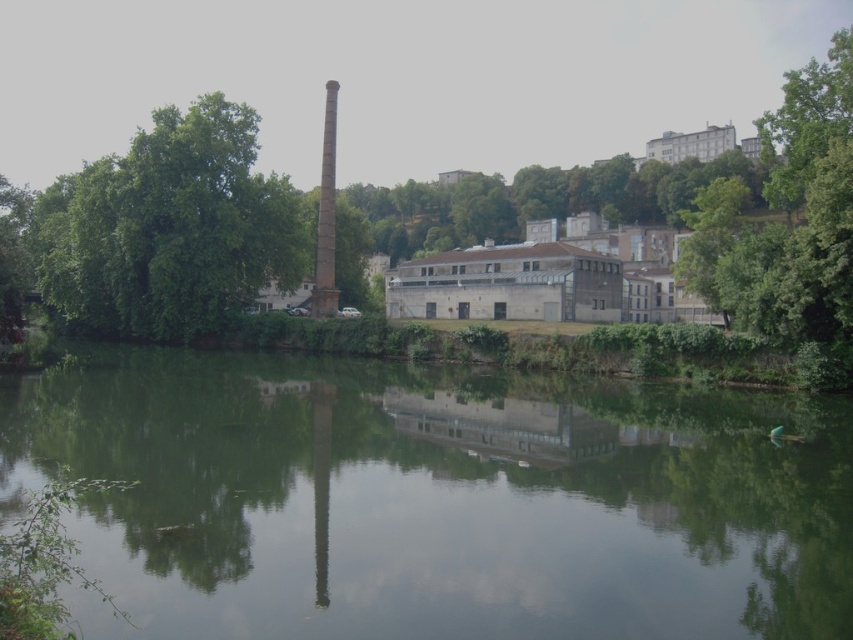
Question: Is the position of green reflective water at center less distant than that of smooth concrete chimney at center?

Choices:
 (A) yes
 (B) no

Answer: (A)

Question: Which point appears closest to the camera in this image?

Choices:
 (A) coord(117,420)
 (B) coord(718,208)
 (C) coord(61,227)
 (D) coord(323,129)

Answer: (A)

Question: Observing the image, what is the correct spatial positioning of green reflective water at center in reference to smooth concrete chimney at center?

Choices:
 (A) left
 (B) right

Answer: (B)

Question: Can you confirm if green leafy tree at upper right is wider than smooth concrete chimney at center?

Choices:
 (A) no
 (B) yes

Answer: (B)

Question: Which is farther from the green leafy tree at left?

Choices:
 (A) smooth concrete chimney at center
 (B) green reflective water at center

Answer: (B)

Question: Which of the following is the closest to the observer?

Choices:
 (A) smooth concrete chimney at center
 (B) green reflective water at center

Answer: (B)